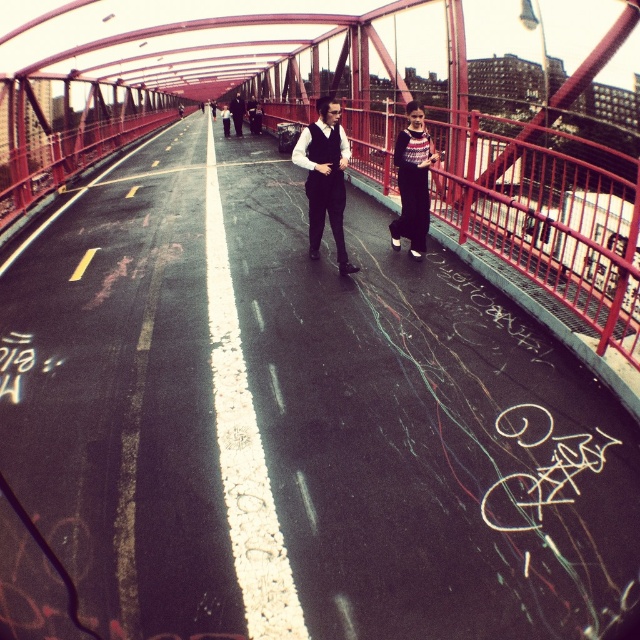
You are a photographer standing on the red metal pedestrian bridge. You notice two people walking side by side at the center of the bridge. One is wearing a matte black vest and the other a dark gray suit. From your position, which person is closer to you between the matte black vest at center and the dark gray suit at center?

The matte black vest at center is closer to you because it is in front of the dark gray suit at center.